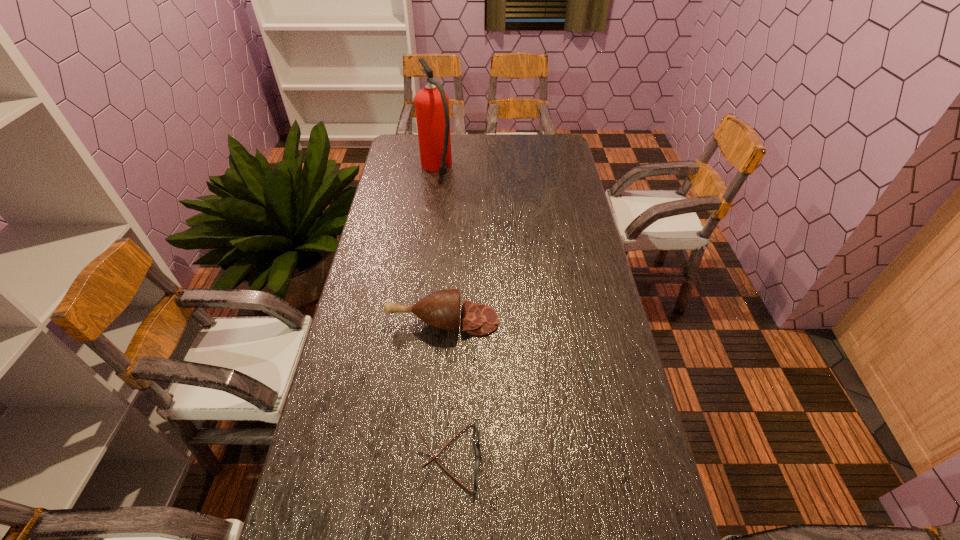
This screenshot has width=960, height=540. Find the location of `the tallest object`. the tallest object is located at coordinates (431, 103).

Identify the location of fire extinguisher. (431, 103).

In order to click on the second nearest object in this screenshot , I will do `click(441, 309)`.

Find the location of a particular element. ham is located at coordinates (441, 309).

You are a GUI agent. You are given a task and a screenshot of the screen. Output one action in this format:
    pyautogui.click(x=<x>, y=<y>)
    Task: Click on the shortest object
    
    Given the screenshot: What is the action you would take?
    pyautogui.click(x=477, y=470)

Where is `the nearest object`? the nearest object is located at coordinates (477, 470).

Where is `vacant point located on the handle side of the tallest object`? Image resolution: width=960 pixels, height=540 pixels. vacant point located on the handle side of the tallest object is located at coordinates (440, 145).

Find the location of `vacant space situated 0.120m on the handle side of the tallest object`. vacant space situated 0.120m on the handle side of the tallest object is located at coordinates (441, 140).

Find the location of a particular element. The width and height of the screenshot is (960, 540). free region located 0.170m on the handle side of the tallest object is located at coordinates (441, 134).

The width and height of the screenshot is (960, 540). In order to click on free spot located at the sliced end of the ham in this screenshot , I will do `click(600, 321)`.